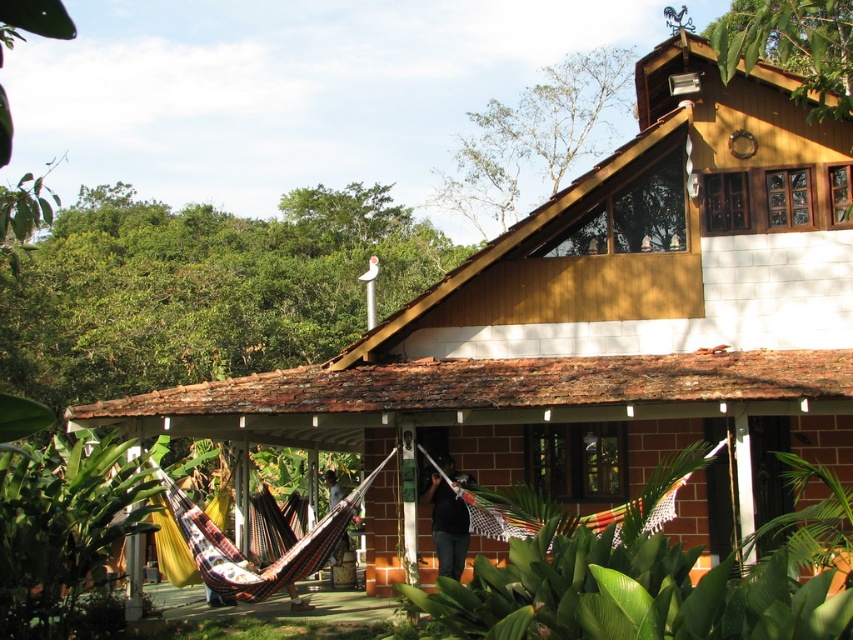
Which is more to the right, green leafy trees at upper left or black fabric at center?

black fabric at center

The image size is (853, 640). Identify the location of green leafy trees at upper left. (202, 289).

Which is in front, point (59, 387) or point (442, 506)?

Point (442, 506) is more forward.

You are a GUI agent. You are given a task and a screenshot of the screen. Output one action in this format:
    pyautogui.click(x=<x>, y=<y>)
    Task: Click on the green leafy trees at upper left
    
    Given the screenshot: What is the action you would take?
    pyautogui.click(x=202, y=289)

Who is lower down, green leafy trees at upper left or green leafy plant at center?

Positioned lower is green leafy plant at center.

Who is more distant from viewer, (306, 324) or (779, 572)?

The point (306, 324) is behind.

The width and height of the screenshot is (853, 640). I want to click on green leafy trees at upper left, so click(202, 289).

Which is more to the left, green leafy plant at center or black fabric at center?

black fabric at center

Is green leafy plant at center to the left of black fabric at center from the viewer's perspective?

No, green leafy plant at center is not to the left of black fabric at center.

Find the location of `green leafy plant at center`. green leafy plant at center is located at coordinates [x=627, y=595].